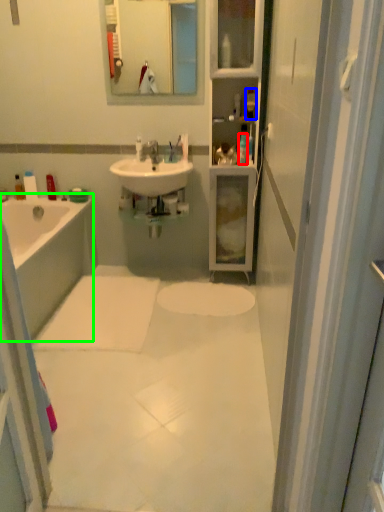
Question: Which object is positioned farthest from toiletry (highlighted by a red box)? Select from toiletry (highlighted by a blue box) and bathtub (highlighted by a green box).

Choices:
 (A) toiletry
 (B) bathtub

Answer: (B)